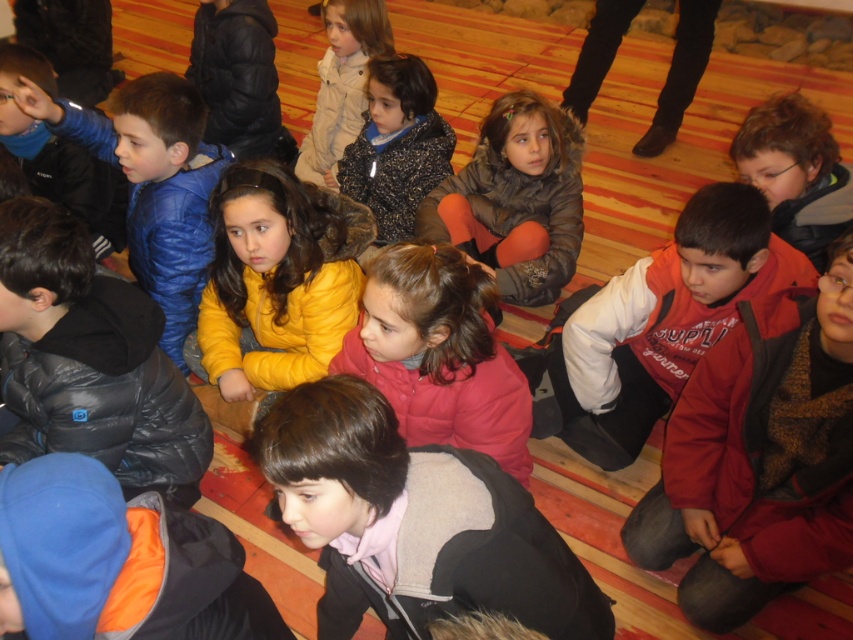
Question: Is matte gray vest at center positioned before light beige jacket at center?

Choices:
 (A) yes
 (B) no

Answer: (A)

Question: Which point is farther from the camera taking this photo?

Choices:
 (A) (773, 221)
 (B) (396, 532)
 (C) (590, 298)
 (D) (428, 298)

Answer: (A)

Question: Which is nearer to the fluffy black coat at center?

Choices:
 (A) brown fuzzy jacket at center
 (B) light beige jacket at center
 (C) brown fuzzy coat at center

Answer: (C)

Question: Is red fleece jacket at lower right to the right of red fleece jacket at center from the viewer's perspective?

Choices:
 (A) yes
 (B) no

Answer: (A)

Question: Does matte gray vest at center have a smaller size compared to red fleece jacket at center?

Choices:
 (A) yes
 (B) no

Answer: (A)

Question: Estimate the real-world distances between objects in this image. Which object is farther from the fluffy black coat at center?

Choices:
 (A) red fleece jacket at center
 (B) matte gray vest at center

Answer: (B)